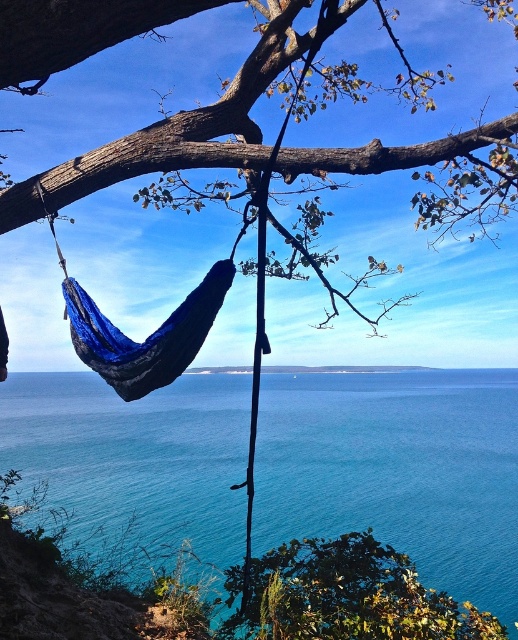
Image resolution: width=518 pixels, height=640 pixels. What do you see at coordinates (398, 470) in the screenshot? I see `blue water at center` at bounding box center [398, 470].

Is blue water at center behind green leafy tree at lower center?

Yes, it is behind green leafy tree at lower center.

Which is behind, point (338, 461) or point (266, 556)?

Point (338, 461)

Locate an element on the screen. This screenshot has height=640, width=518. blue water at center is located at coordinates (398, 470).

Looking at this image, does blue water at center appear under brown rough tree branch at upper center?

Correct, blue water at center is located below brown rough tree branch at upper center.

From the picture: Is blue water at center taller than brown rough tree branch at upper center?

Yes, blue water at center is taller than brown rough tree branch at upper center.

This screenshot has height=640, width=518. What do you see at coordinates (398, 470) in the screenshot?
I see `blue water at center` at bounding box center [398, 470].

The width and height of the screenshot is (518, 640). I want to click on blue water at center, so click(398, 470).

Is point (23, 56) positioned behind point (254, 636)?

No, (23, 56) is in front of (254, 636).

Which of these two, brown rough tree branch at upper center or green leafy tree at lower center, stands shorter?

Standing shorter between the two is green leafy tree at lower center.

Is point (68, 1) positioned in front of point (363, 600)?

Yes, it is.

Identify the location of brown rough tree branch at upper center. This screenshot has height=640, width=518. (175, 131).